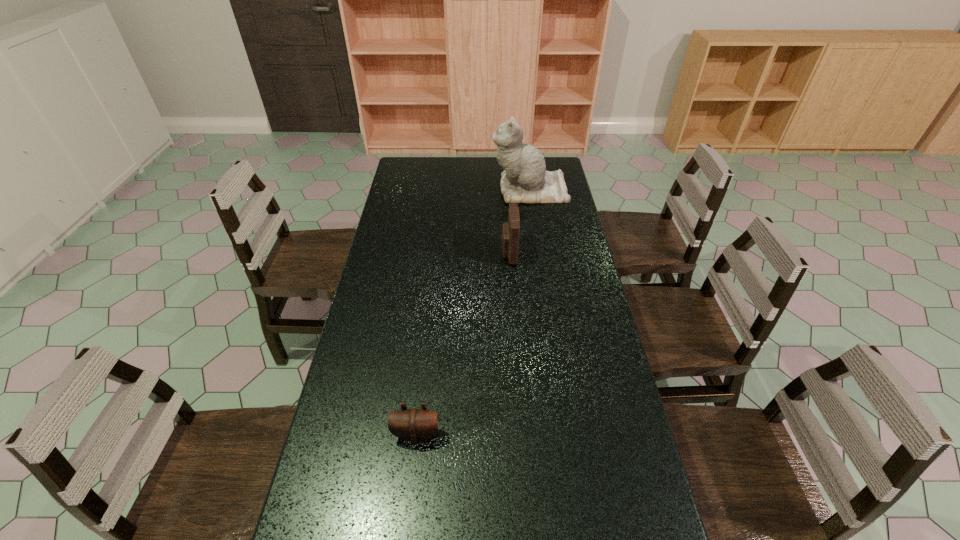
This screenshot has height=540, width=960. What are the coordinates of `cat` in the screenshot? It's located at (525, 180).

Locate an element on the screen. Image resolution: width=960 pixels, height=540 pixels. the farthest object is located at coordinates (525, 180).

Identify the location of the second nearest object. (510, 230).

Identify the location of the right pouch. (510, 230).

In order to click on the shorter pouch in this screenshot , I will do `click(414, 425)`.

Locate an element on the screen. the shortest object is located at coordinates (414, 425).

Find the location of a particular element. This screenshot has height=540, width=960. vacant region located 0.240m on the front-facing side of the farthest object is located at coordinates (438, 190).

Find the location of a particular element. This screenshot has width=960, height=540. vacant space located 0.280m on the front-facing side of the farthest object is located at coordinates (428, 190).

The image size is (960, 540). Find the location of `free space located on the front-facing side of the farthest object`. free space located on the front-facing side of the farthest object is located at coordinates (468, 190).

Identify the location of vacant region located with an open flap on the taller pouch. (458, 253).